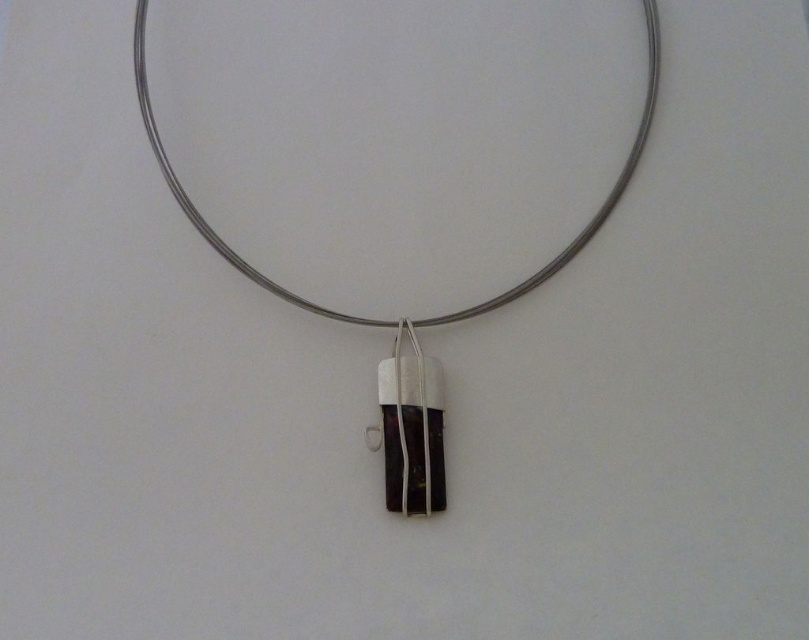
Question: Among these objects, which one is nearest to the camera?

Choices:
 (A) matte silver pendant at center
 (B) silver wire necklace at center

Answer: (B)

Question: Among these points, which one is farthest from the camera?

Choices:
 (A) (380, 433)
 (B) (155, 156)

Answer: (A)

Question: Does silver wire necklace at center lie in front of matte silver pendant at center?

Choices:
 (A) yes
 (B) no

Answer: (A)

Question: Which object appears closest to the camera in this image?

Choices:
 (A) matte silver pendant at center
 (B) silver wire necklace at center

Answer: (B)

Question: Is silver wire necklace at center to the right of matte silver pendant at center from the viewer's perspective?

Choices:
 (A) no
 (B) yes

Answer: (A)

Question: Does silver wire necklace at center have a smaller size compared to matte silver pendant at center?

Choices:
 (A) no
 (B) yes

Answer: (A)